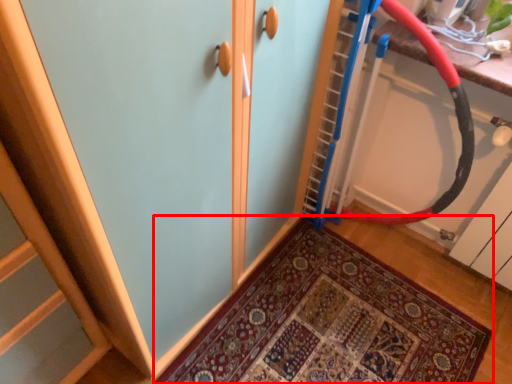
Question: From the image's perspective, what is the correct spatial positioning of door (annotated by the red box) in reference to battle rope?

Choices:
 (A) above
 (B) below

Answer: (B)